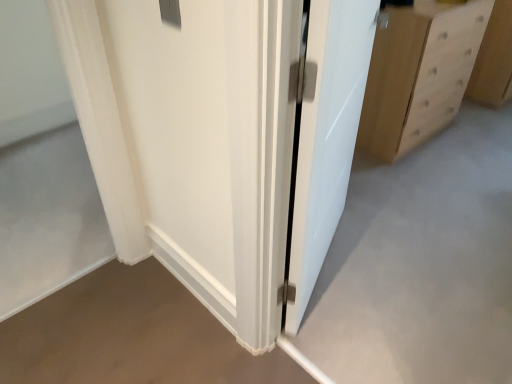
In order to face white glossy door at center, should I rotate leftwards or rightwards?

It's best to rotate right around 12.077 degrees.

Image resolution: width=512 pixels, height=384 pixels. What do you see at coordinates (419, 74) in the screenshot?
I see `light brown wood chest of drawers at right` at bounding box center [419, 74].

What is the approximate height of light brown wood chest of drawers at right?

light brown wood chest of drawers at right is 34.46 inches tall.

The image size is (512, 384). What do you see at coordinates (452, 42) in the screenshot?
I see `light wood drawer at right` at bounding box center [452, 42].

In order to click on white sheer curtain at left in this screenshot , I will do `click(101, 123)`.

Where is `white glossy door at center`? Image resolution: width=512 pixels, height=384 pixels. white glossy door at center is located at coordinates (325, 136).

Is white sheer curtain at left further to the viewer compared to light brown wood chest of drawers at right?

No, it is not.

Is white sheer curtain at left taller or shorter than light brown wood chest of drawers at right?

Clearly, white sheer curtain at left is taller compared to light brown wood chest of drawers at right.

Is white sheer curtain at left oriented towards light brown wood chest of drawers at right?

No, white sheer curtain at left is not turned towards light brown wood chest of drawers at right.

Is white sheer curtain at left not inside light brown wood chest of drawers at right?

white sheer curtain at left lies outside light brown wood chest of drawers at right's area.

Which object is wider, white glossy door at center or light wood drawer at right?

With larger width is light wood drawer at right.

Considering the points (309, 270) and (446, 47), which point is in front, point (309, 270) or point (446, 47)?

Point (309, 270)

From a real-world perspective, is white glossy door at center on top of light wood drawer at right?

Yes, from a real-world perspective, white glossy door at center is over light wood drawer at right

Between white glossy door at center and light wood drawer at right, which one appears on the right side from the viewer's perspective?

light wood drawer at right is more to the right.

Is light brown wood chest of drawers at right far away from white glossy door at center?

light brown wood chest of drawers at right is near white glossy door at center, not far away.

Considering the positions of objects light brown wood chest of drawers at right and white glossy door at center in the image provided, who is behind, light brown wood chest of drawers at right or white glossy door at center?

light brown wood chest of drawers at right.

From a real-world perspective, which object stands above the other?

white glossy door at center, from a real-world perspective.

Consider the image. Does light brown wood chest of drawers at right contain white glossy door at center?

No, white glossy door at center is not a part of light brown wood chest of drawers at right.

Is white glossy door at center oriented towards light brown wood chest of drawers at right?

No.

Looking at their sizes, would you say white glossy door at center is wider or thinner than light brown wood chest of drawers at right?

white glossy door at center is thinner than light brown wood chest of drawers at right.

How much distance is there between white glossy door at center and light brown wood chest of drawers at right?

white glossy door at center and light brown wood chest of drawers at right are 33.63 inches apart from each other.

Considering the relative sizes of white glossy door at center and light brown wood chest of drawers at right in the image provided, is white glossy door at center shorter than light brown wood chest of drawers at right?

No, white glossy door at center is not shorter than light brown wood chest of drawers at right.

Which of these two, light brown wood chest of drawers at right or light wood drawer at right, is thinner?

Thinner between the two is light brown wood chest of drawers at right.

Is light brown wood chest of drawers at right inside the boundaries of light wood drawer at right, or outside?

light brown wood chest of drawers at right is outside light wood drawer at right.

Find the location of a particular element. drawer behind the light brown wood chest of drawers at right is located at coordinates (452, 42).

How many degrees apart are the facing directions of light brown wood chest of drawers at right and light wood drawer at right?

The angle between the facing direction of light brown wood chest of drawers at right and the facing direction of light wood drawer at right is 1.04 degrees.

From the image's perspective, between white sheer curtain at left and white glossy door at center, who is located below?

white sheer curtain at left appears lower in the image.

Can you tell me how much white sheer curtain at left and white glossy door at center differ in facing direction?

24.5 degrees.

Is point (116, 158) positioned after point (312, 261)?

No.

From the picture: Who is smaller, white sheer curtain at left or white glossy door at center?

white sheer curtain at left is smaller.

This screenshot has height=384, width=512. In order to click on drawer located underneath the white sheer curtain at left (from a real-world perspective) in this screenshot , I will do `click(452, 42)`.

Is white sheer curtain at left taller than light wood drawer at right?

Correct, white sheer curtain at left is much taller as light wood drawer at right.

I want to click on chest of drawers above the white sheer curtain at left (from the image's perspective), so click(419, 74).

Locate an element on the screen. This screenshot has height=384, width=512. drawer below the white glossy door at center (from a real-world perspective) is located at coordinates (452, 42).

Based on their spatial positions, is white sheer curtain at left or light brown wood chest of drawers at right further from white glossy door at center?

The object further to white glossy door at center is light brown wood chest of drawers at right.

Based on their spatial positions, is light brown wood chest of drawers at right or light wood drawer at right closer to white sheer curtain at left?

Based on the image, light brown wood chest of drawers at right appears to be nearer to white sheer curtain at left.

In the scene shown: Based on their spatial positions, is white glossy door at center or light wood drawer at right closer to white sheer curtain at left?

white glossy door at center.

Based on the photo, based on their spatial positions, is white sheer curtain at left or light wood drawer at right further from white glossy door at center?

Based on the image, light wood drawer at right appears to be further to white glossy door at center.

From the image, which object appears to be farther from white sheer curtain at left, light brown wood chest of drawers at right or white glossy door at center?

light brown wood chest of drawers at right is positioned further to the anchor white sheer curtain at left.

When comparing their distances from light wood drawer at right, does light brown wood chest of drawers at right or white glossy door at center seem closer?

Among the two, light brown wood chest of drawers at right is located nearer to light wood drawer at right.

From the image, which object appears to be nearer to light brown wood chest of drawers at right, white glossy door at center or white sheer curtain at left?

white glossy door at center is closer to light brown wood chest of drawers at right.

Consider the image. Based on their spatial positions, is light wood drawer at right or white sheer curtain at left further from light brown wood chest of drawers at right?

Based on the image, white sheer curtain at left appears to be further to light brown wood chest of drawers at right.

Find the location of a particular element. Image resolution: width=512 pixels, height=384 pixels. door between white sheer curtain at left and light wood drawer at right is located at coordinates (325, 136).

At what (x,y) coordinates should I click in order to perform the action: click on chest of drawers between white sheer curtain at left and light wood drawer at right. Please return your answer as a coordinate pair (x, y). The width and height of the screenshot is (512, 384). Looking at the image, I should click on (419, 74).

Identify the location of door located between white sheer curtain at left and light brown wood chest of drawers at right in the left-right direction. (325, 136).

Locate an element on the screen. This screenshot has height=384, width=512. chest of drawers between white glossy door at center and light wood drawer at right in the front-back direction is located at coordinates (419, 74).